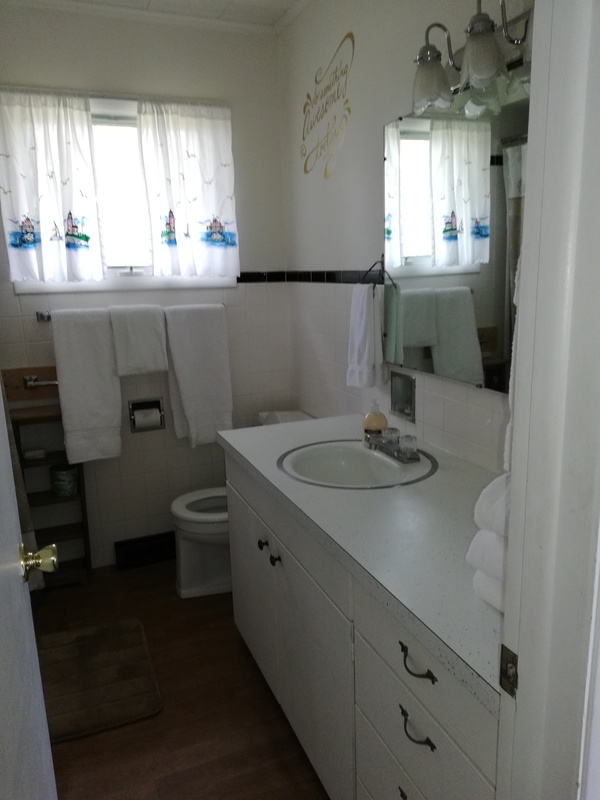
Find the location of `door`. door is located at coordinates click(x=17, y=690).